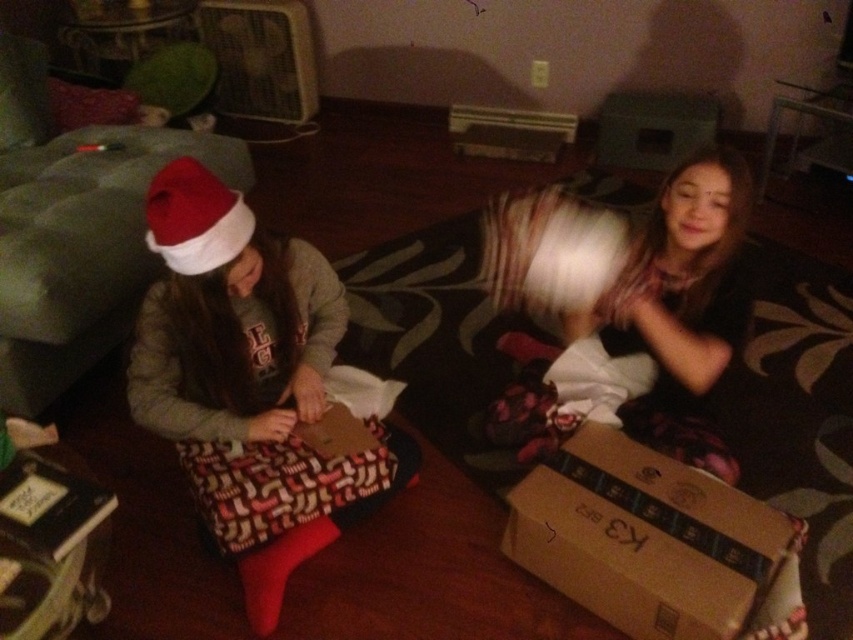
Question: Does matte black gift at left have a lesser width compared to brown cardboard box at lower right?

Choices:
 (A) yes
 (B) no

Answer: (B)

Question: Does matte black gift at left have a larger size compared to red velvet santa hat at left?

Choices:
 (A) yes
 (B) no

Answer: (A)

Question: Estimate the real-world distances between objects in this image. Which object is closer to the matte black gift at left?

Choices:
 (A) brown cardboard box at lower right
 (B) red velvet santa hat at left

Answer: (B)

Question: Which point is closer to the camera?

Choices:
 (A) red velvet santa hat at left
 (B) matte black gift at left
 (C) brown cardboard box at lower right

Answer: (A)

Question: Does brown cardboard box at lower right appear under red velvet santa hat at left?

Choices:
 (A) no
 (B) yes

Answer: (B)

Question: Which point is closer to the camera?

Choices:
 (A) (198, 500)
 (B) (764, 586)

Answer: (B)